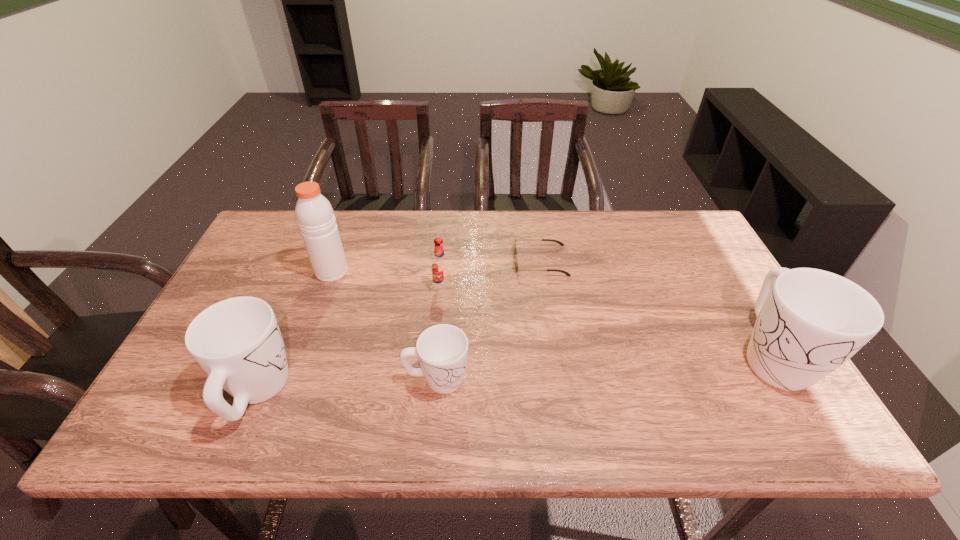
Find the location of a particular element. This screenshot has height=540, width=960. blank region between the root beer and the sunglasses is located at coordinates (492, 274).

You are a GUI agent. You are given a task and a screenshot of the screen. Output one action in this format:
    pyautogui.click(x=<x>, y=<y>)
    Task: Click on the free space between the leftmost mug and the tallest object
    This screenshot has height=540, width=960.
    Given the screenshot: What is the action you would take?
    pyautogui.click(x=295, y=332)

Identify the location of vacant area between the rightmost mug and the third shortest object. (607, 321).

At what (x,y) coordinates should I click in order to perform the action: click on blank region between the shortest object and the second mug from right to left. Please return your answer as a coordinate pair (x, y). This screenshot has width=960, height=540. Looking at the image, I should click on (489, 320).

The height and width of the screenshot is (540, 960). Identify the location of free space between the rightmost mug and the sunglasses. (657, 308).

Where is `empty space that is in between the root beer and the shaker`? empty space that is in between the root beer and the shaker is located at coordinates (387, 280).

What are the coordinates of `the second closest object to the root beer` in the screenshot? It's located at (442, 350).

This screenshot has width=960, height=540. Identify the location of the closest object to the root beer. (515, 249).

Locate an element on the screen. The width and height of the screenshot is (960, 540). mug that is the closest to the rightmost mug is located at coordinates (442, 350).

Identify the location of mug object that ranks as the second closest to the shortest object. (809, 322).